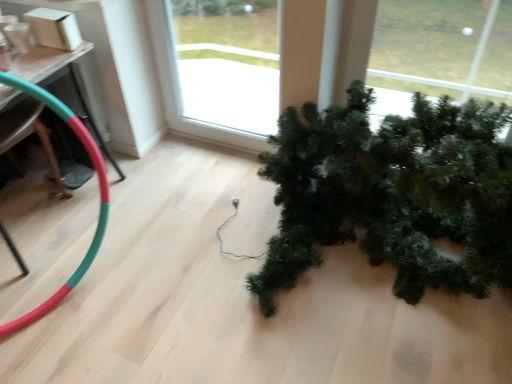
This screenshot has height=384, width=512. In order to click on vacant space underneath green matte christmas tree at lower right (from a real-world perspective) in this screenshot , I will do `click(377, 288)`.